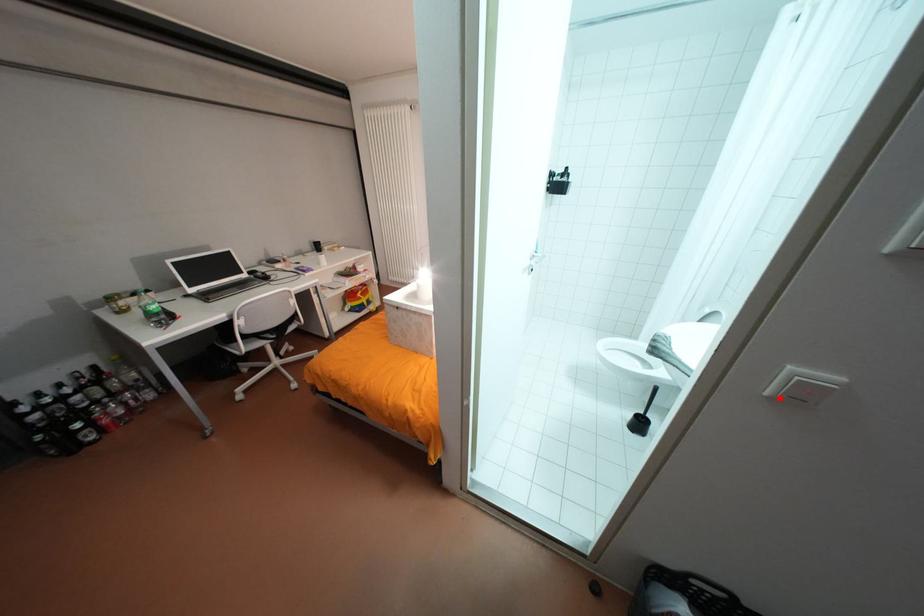
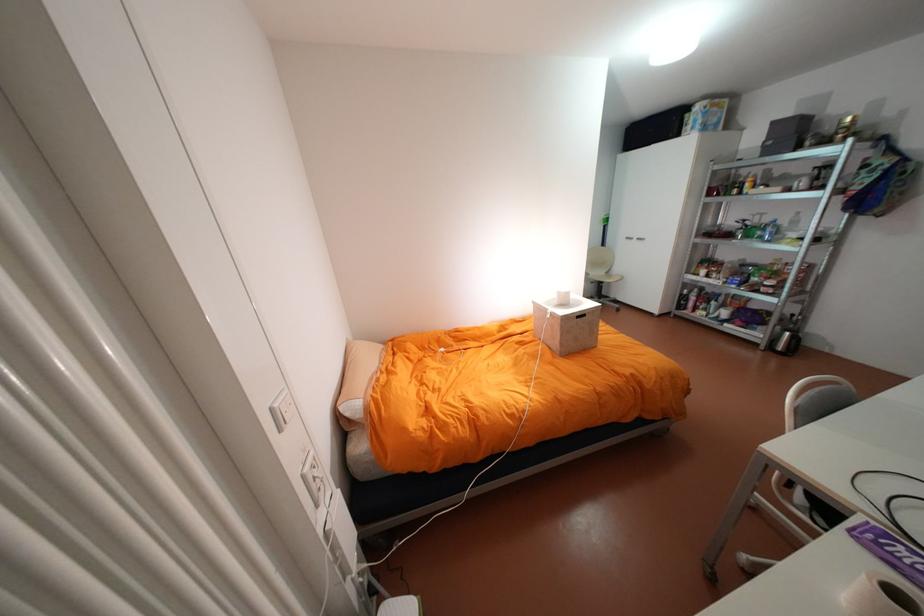
Question: I am providing you with two images of the same scene from different viewpoints. A red point is marked on the first image. Can you still see the location of the red point in image 2?

Choices:
 (A) Yes
 (B) No

Answer: (B)